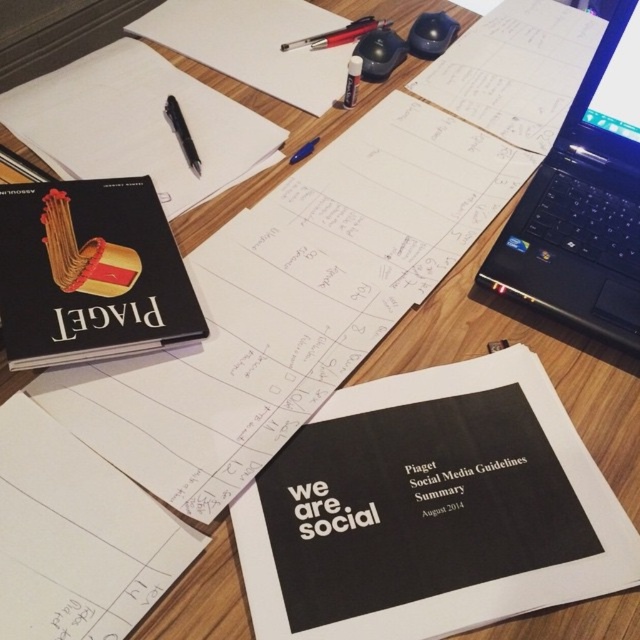
You are setting up a new workspace and want to place the matte black mouse at upper center and the metallic pen at upper center on your desk. Since you want to ensure that one item is taller than the other for visibility, which object should you choose to place in a position where height matters?

The matte black mouse at upper center is taller than the metallic pen at upper center, so you should place the matte black mouse at upper center in the position where height matters.

You are a person with a 12 inch ruler. You want to measure the distance from your eyes to the matte black mouse at upper center. Can you estimate how many rulers you need to stack to reach that distance?

The distance of matte black mouse at upper center from camera is 29.32 inches. Since each ruler is 12 inches, you would need 3 rulers stacked to cover the distance.